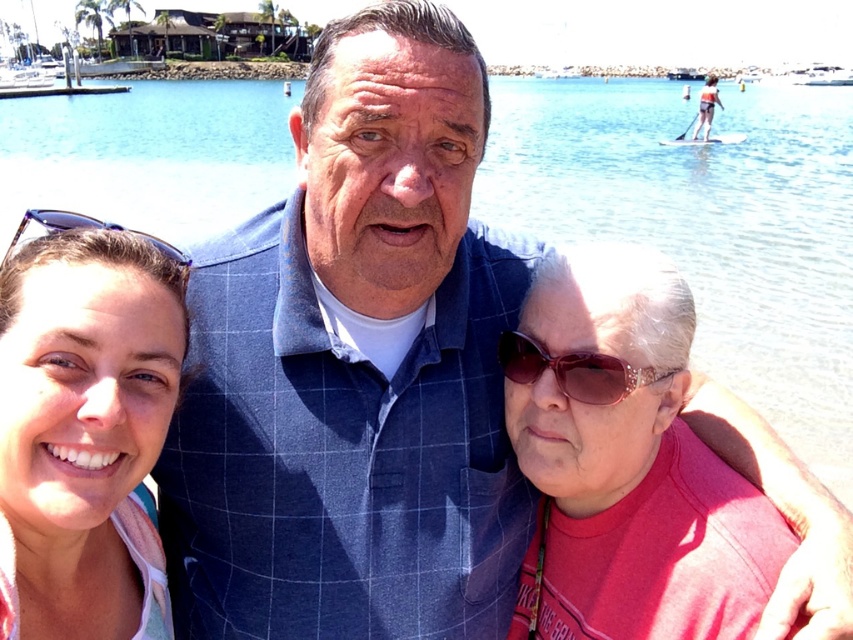
Question: Among these points, which one is nearest to the camera?

Choices:
 (A) (828, 108)
 (B) (84, 624)

Answer: (B)

Question: Is matte blue sunglasses at upper left above pink fabric at upper right?

Choices:
 (A) yes
 (B) no

Answer: (B)

Question: Is clear blue water at center wider than pink fabric at upper right?

Choices:
 (A) no
 (B) yes

Answer: (B)

Question: Which of these objects is positioned closest to the sparkly brown sunglasses at center?

Choices:
 (A) blue plastic sunglasses at left
 (B) clear blue water at center
 (C) matte blue sunglasses at upper left
 (D) pink fabric at upper right

Answer: (A)

Question: Which point is closer to the camera taking this photo?

Choices:
 (A) (120, 570)
 (B) (534, 348)

Answer: (A)

Question: Is blue plastic sunglasses at left closer to camera compared to pink fabric at upper right?

Choices:
 (A) no
 (B) yes

Answer: (B)